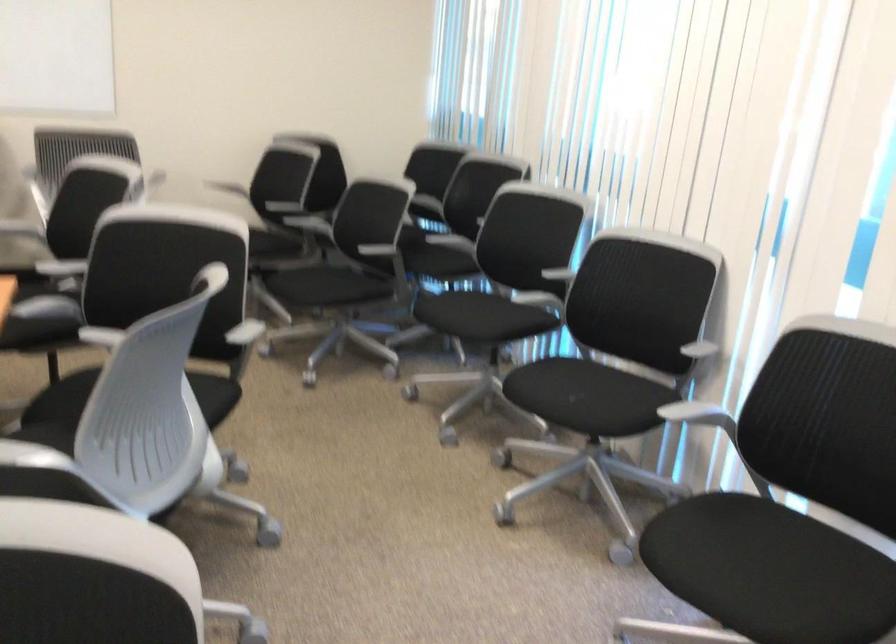
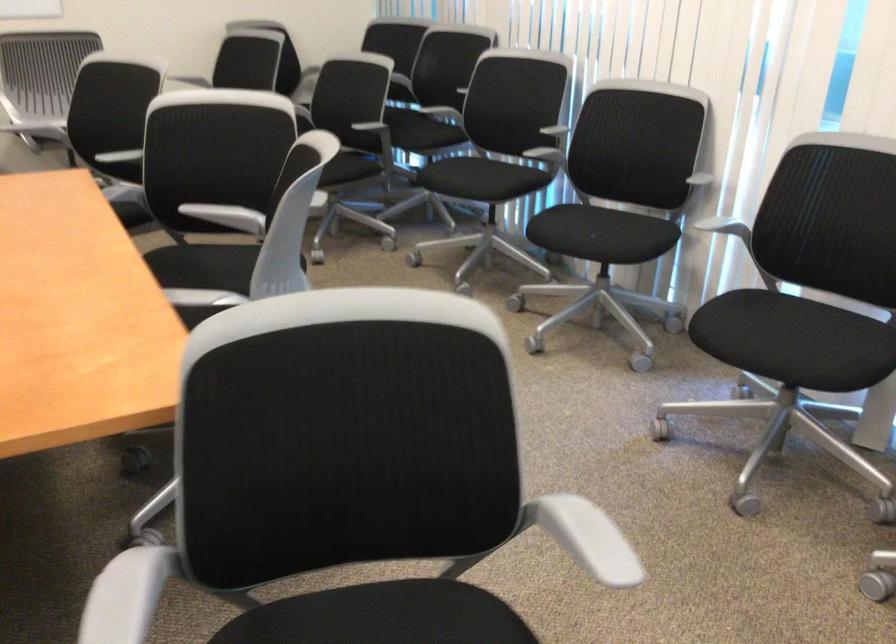
In the second image, find the point that corresponds to the point at 552,290 in the first image.

(543, 146)